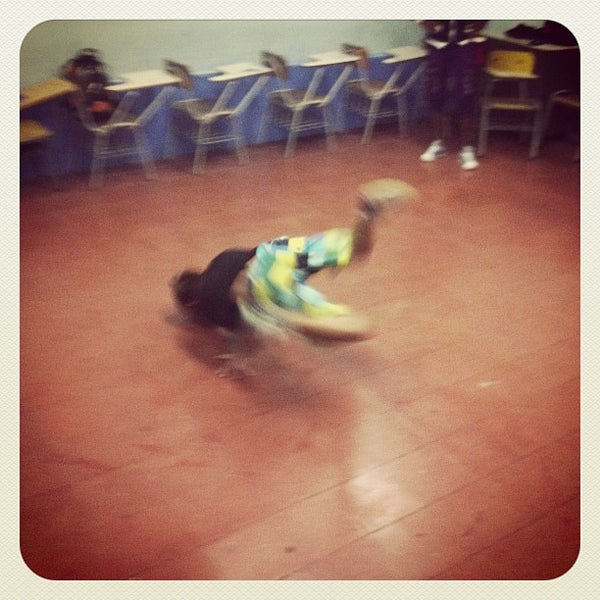
Where is `desk chairs`? Image resolution: width=600 pixels, height=600 pixels. desk chairs is located at coordinates (119, 122), (218, 114), (300, 98), (381, 90), (519, 127), (35, 131).